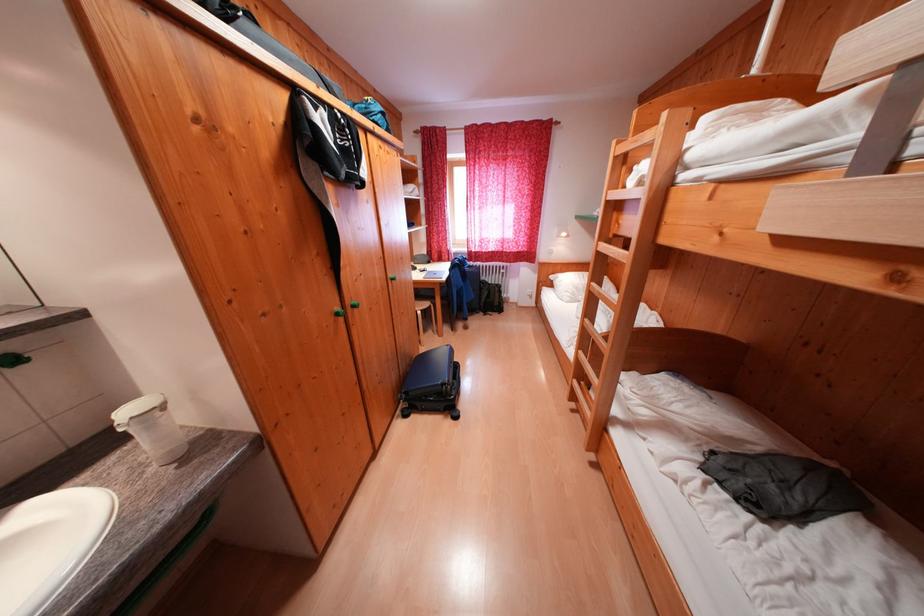
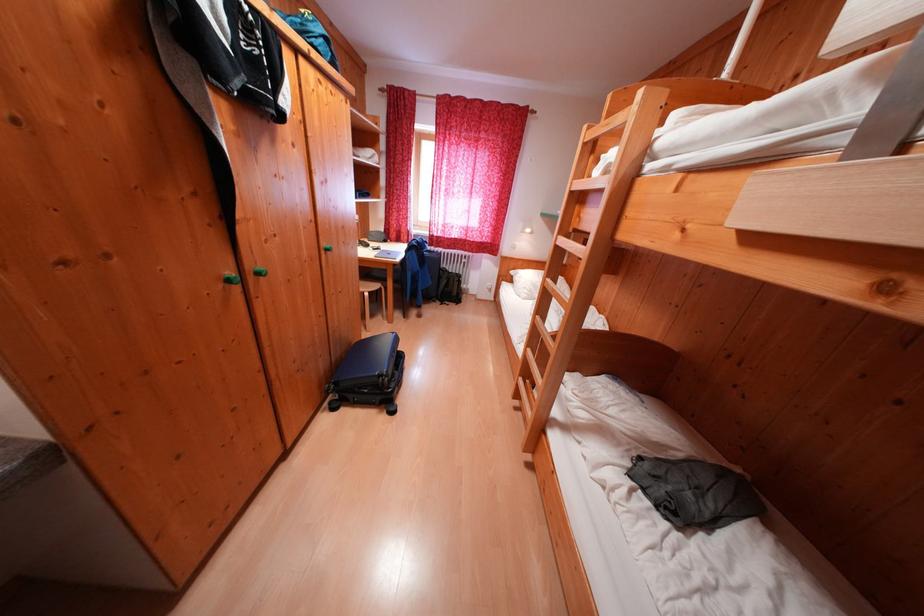
Locate, in the second image, the point that corresponds to [346,314] in the first image.

(238, 278)